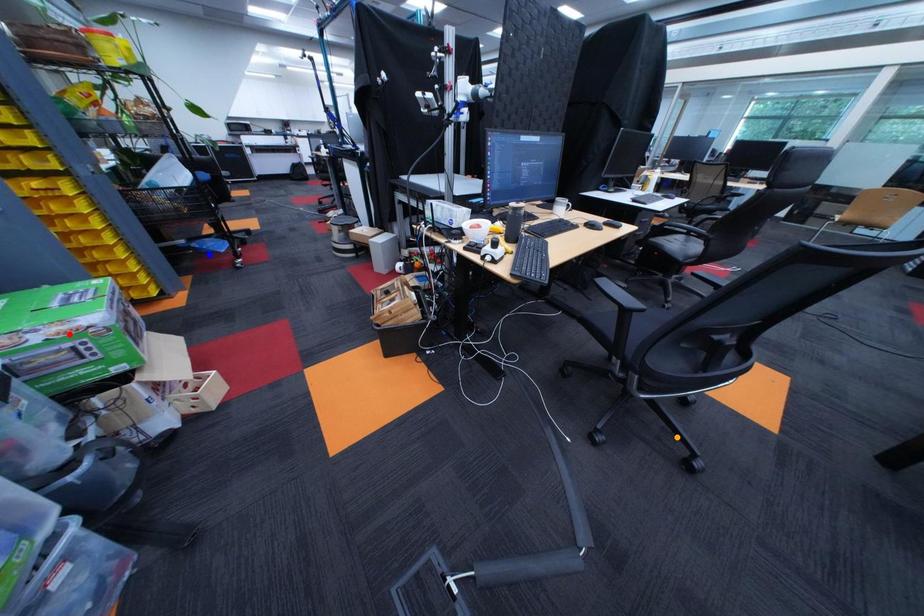
Order these from nearest to farthest:
- orange point
- red point
- blue point

1. red point
2. orange point
3. blue point